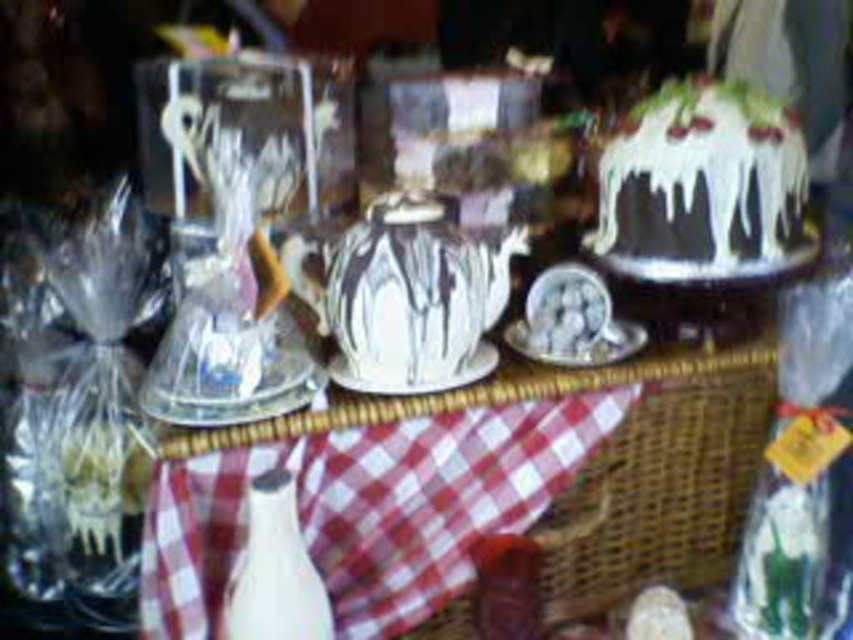
Question: Is red checkered fabric at center to the left of white glossy cake at upper right from the viewer's perspective?

Choices:
 (A) no
 (B) yes

Answer: (B)

Question: Among these points, which one is nearest to the camera?

Choices:
 (A) (422, 592)
 (B) (604, 349)
 (C) (622, 198)

Answer: (A)

Question: Which point is farther from the camera taking this photo?

Choices:
 (A) (610, 344)
 (B) (280, 467)
 (C) (753, 186)

Answer: (A)

Question: Does red checkered fabric at center appear on the right side of white glossy bottle at center?

Choices:
 (A) no
 (B) yes

Answer: (B)

Question: Is red checkered fabric at center bigger than white glossy cake at upper right?

Choices:
 (A) no
 (B) yes

Answer: (B)

Question: Which point is closer to the camera?

Choices:
 (A) red checkered fabric at center
 (B) white glossy cake at upper right

Answer: (A)